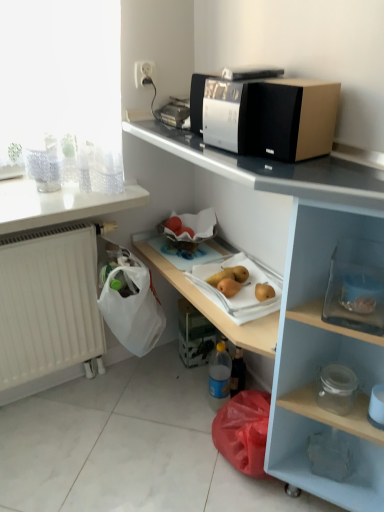
Question: Is silver metallic microwave at upper center wider or thinner than yellow matte pears at center, which is counted as the 2th fruit, starting from the left?

Choices:
 (A) thin
 (B) wide

Answer: (B)

Question: Is silver metallic microwave at upper center bigger or smaller than yellow matte pears at center, marked as the first fruit in a right-to-left arrangement?

Choices:
 (A) big
 (B) small

Answer: (A)

Question: Based on their relative distances, which object is farther from the white glossy countertop at upper center, which is the first countertop from right to left?

Choices:
 (A) black plastic microwave at upper center, acting as the first appliance starting from the top
 (B) yellow matte pears at center, marked as the first fruit in a right-to-left arrangement
 (C) transparent glass jar at lower right, the second appliance from the left
 (D) white matte radiator at lower left
 (E) white plastic socket at upper center

Answer: (E)

Question: Considering the real-world distances, which object is closest to the white plastic socket at upper center?

Choices:
 (A) white glossy countertop at upper left, which ranks as the 2th countertop in right-to-left order
 (B) white matte radiator at lower left
 (C) silver metallic microwave at upper center
 (D) yellow matte pear at lower center, the 2th fruit in the right-to-left sequence
 (E) yellow matte pears at center, which is counted as the 2th fruit, starting from the left

Answer: (A)